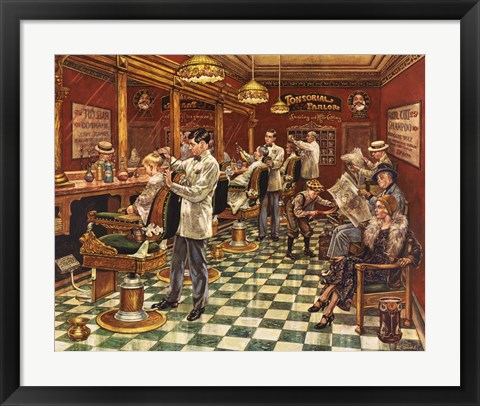
Find the location of a particular element. The image size is (480, 406). mirrors is located at coordinates (88, 114), (150, 116), (205, 116), (239, 133).